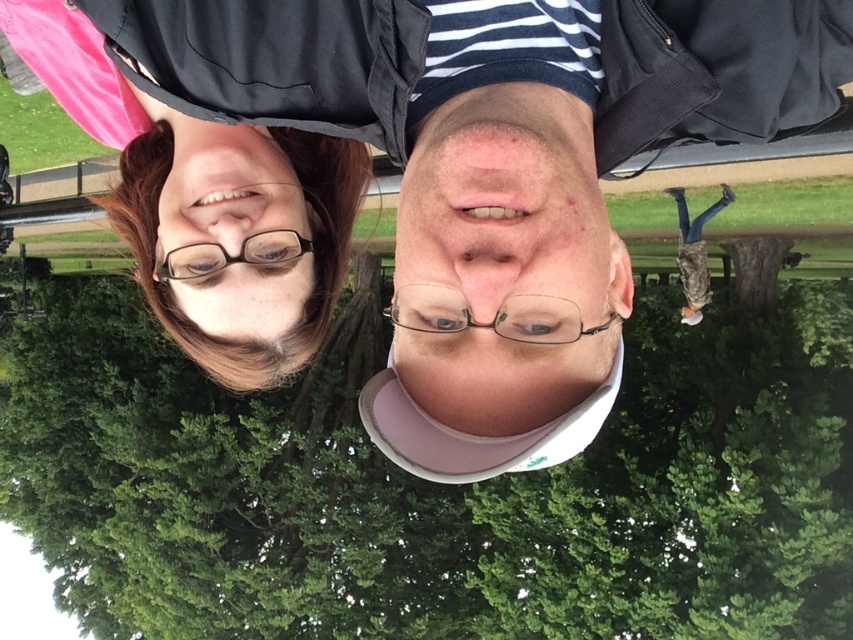
Question: Does green leafy tree at center appear on the left side of matte black glasses at upper left?

Choices:
 (A) no
 (B) yes

Answer: (B)

Question: Among these objects, which one is nearest to the camera?

Choices:
 (A) clear plastic glasses at upper center
 (B) green leafy tree at center
 (C) smooth skin face at center
 (D) matte black glasses at upper left

Answer: (C)

Question: Is green leafy tree at center to the right of matte black glasses at upper left from the viewer's perspective?

Choices:
 (A) no
 (B) yes

Answer: (A)

Question: Among these objects, which one is nearest to the camera?

Choices:
 (A) smooth skin face at center
 (B) green leafy tree at center
 (C) clear plastic glasses at upper center
 (D) matte black glasses at upper left

Answer: (A)

Question: Does green leafy tree at center appear on the left side of matte black glasses at upper left?

Choices:
 (A) yes
 (B) no

Answer: (A)

Question: Estimate the real-world distances between objects in this image. Which object is farther from the matte black glasses at upper left?

Choices:
 (A) clear plastic glasses at upper center
 (B) green leafy tree at center

Answer: (B)